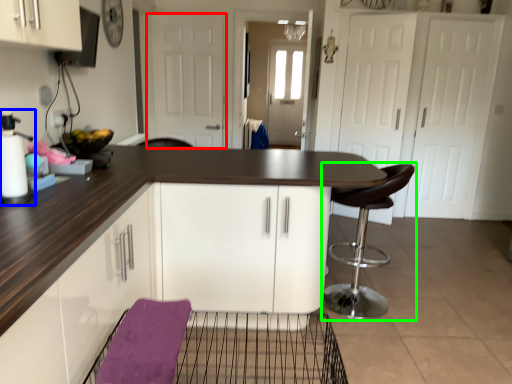
Question: Considering the real-world distances, which object is closest to door (highlighted by a red box)? appliance (highlighted by a blue box) or chair (highlighted by a green box).

Choices:
 (A) appliance
 (B) chair

Answer: (B)